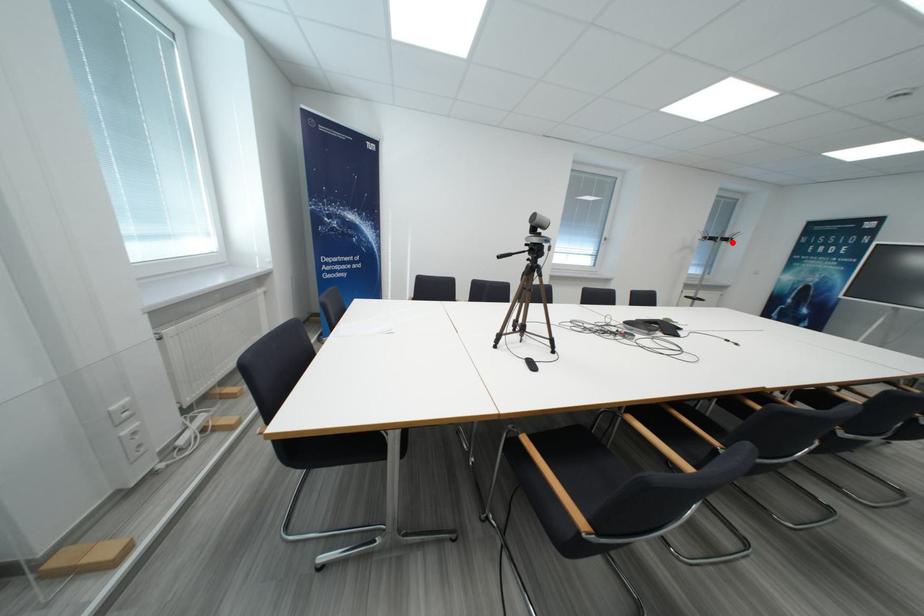
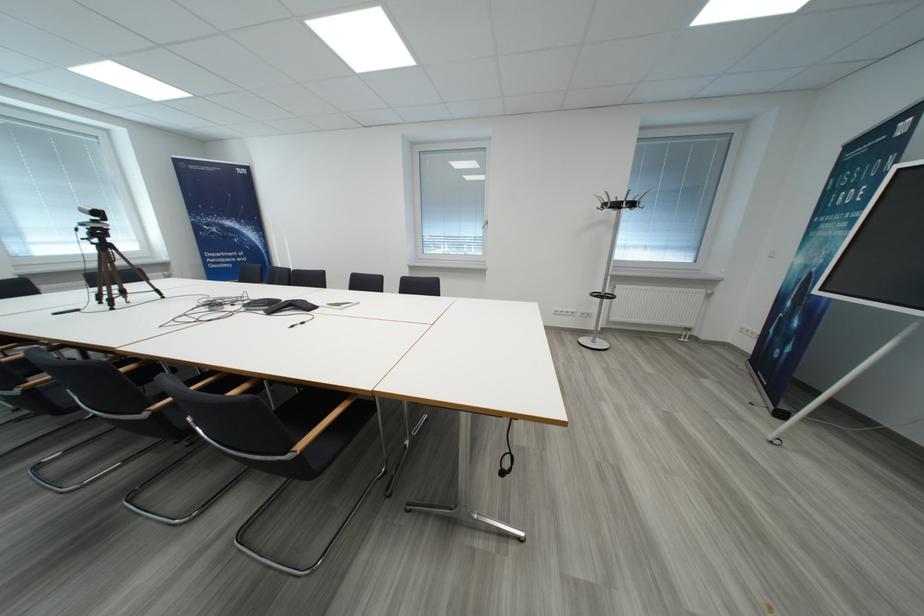
Find the pixel in the second image that matches the highlighted location in the first image.

(623, 208)